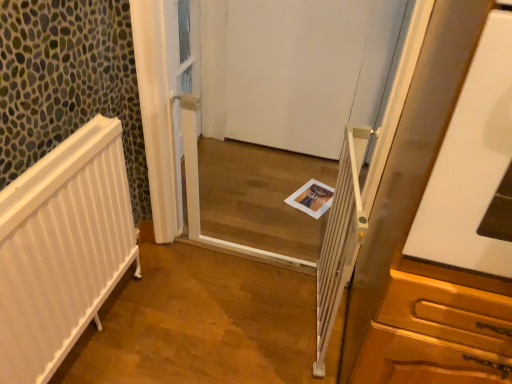
This screenshot has width=512, height=384. I want to click on vacant space in white paper magazine at center (from a real-world perspective), so click(x=303, y=196).